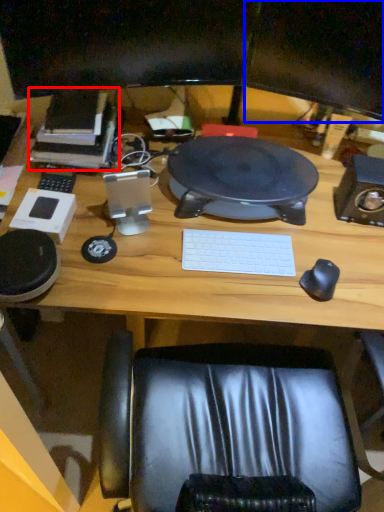
Question: Which of the following is the closest to the observer, book (highlighted by a red box) or computer monitor (highlighted by a blue box)?

Choices:
 (A) book
 (B) computer monitor

Answer: (B)